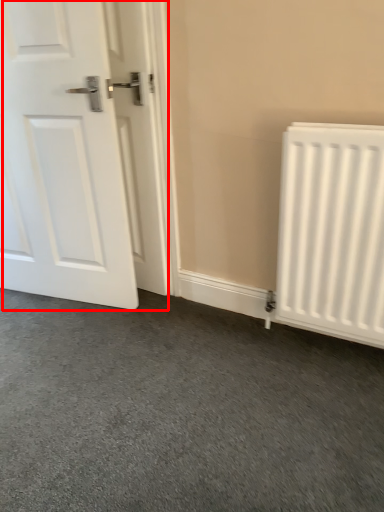
Question: Considering the relative positions of door (annotated by the red box) and radiator in the image provided, where is door (annotated by the red box) located with respect to the staircase?

Choices:
 (A) right
 (B) left

Answer: (B)